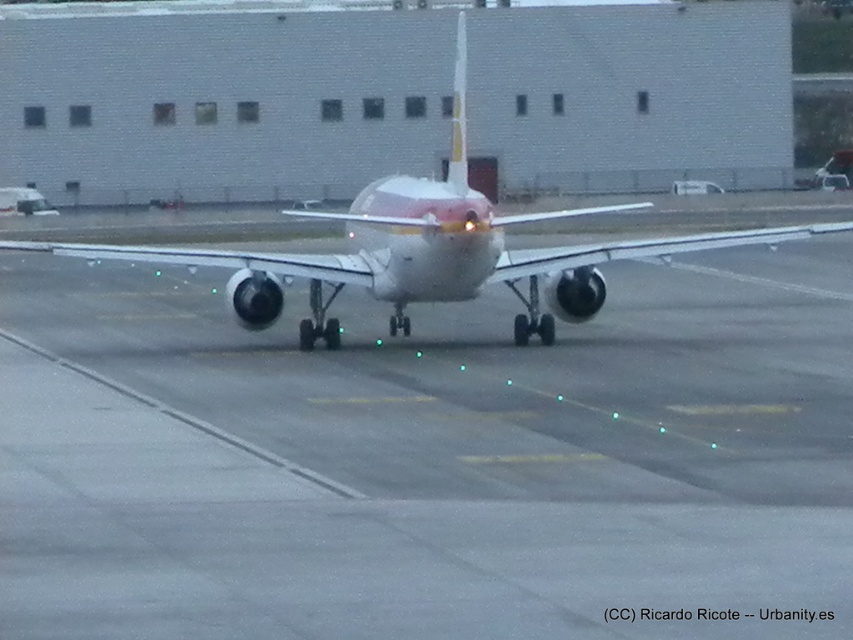
Is gray asphalt runway at center positioned in front of white glossy airplane at center?

That is True.

Who is lower down, gray asphalt runway at center or white glossy airplane at center?

gray asphalt runway at center is below.

Does point (408, 449) come closer to viewer compared to point (495, 266)?

That is True.

Identify the location of gray asphalt runway at center. Image resolution: width=853 pixels, height=640 pixels. coord(427,458).